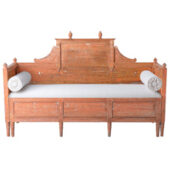
Where is `pillow on left side of bench`? This screenshot has width=170, height=170. pillow on left side of bench is located at coordinates (154, 86).